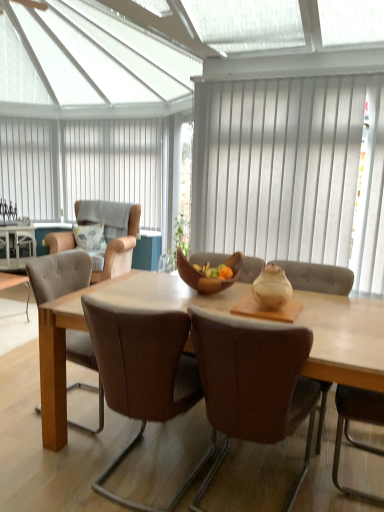
The height and width of the screenshot is (512, 384). Find the location of `vacant space in front of brown leather chair at left, the 2th chair in the back-to-front sequence`. vacant space in front of brown leather chair at left, the 2th chair in the back-to-front sequence is located at coordinates [x=61, y=455].